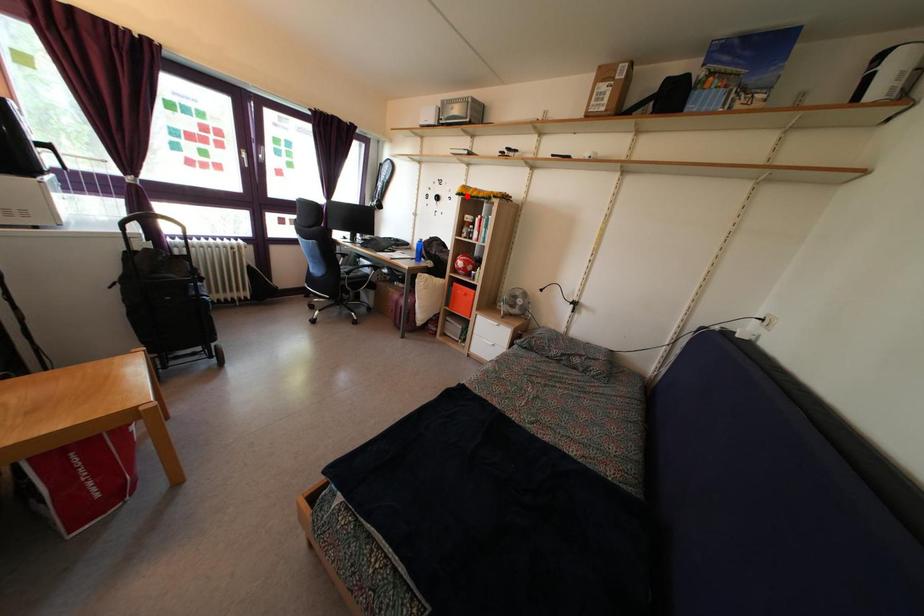
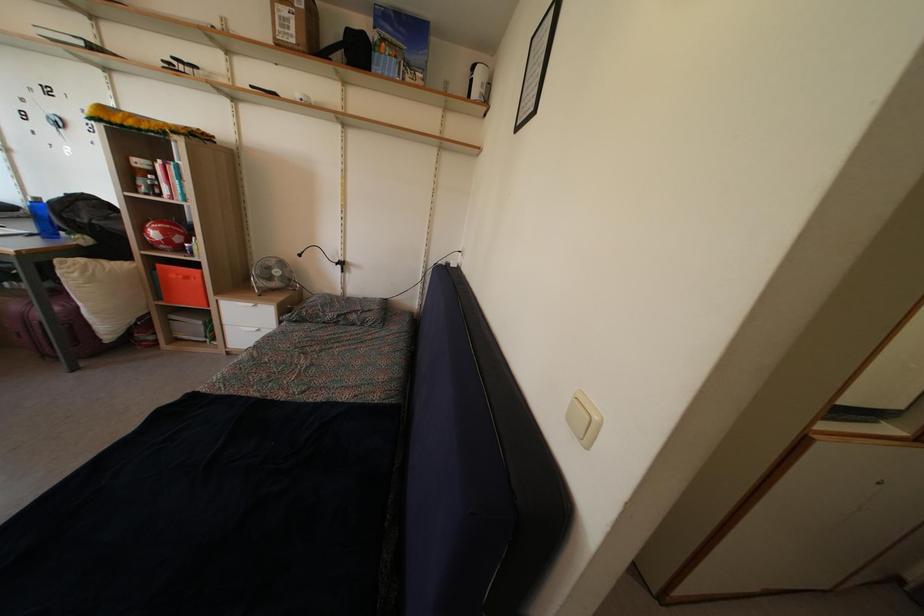
Locate, in the second image, the point that corresponds to the highlighted location in the first image.

(106, 116)